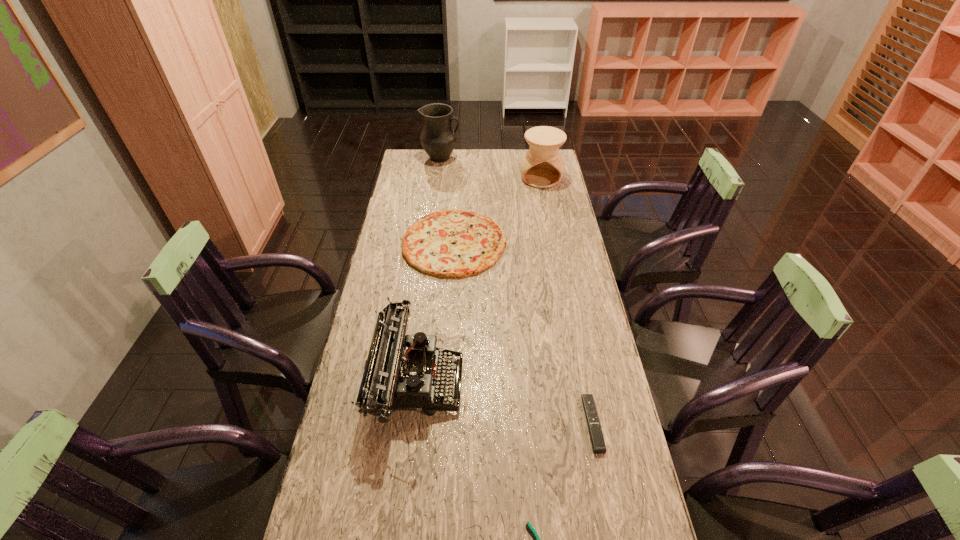
I want to click on the farthest object, so click(x=438, y=139).

At what (x,y) coordinates should I click in order to perform the action: click on pottery. Please return your answer as a coordinate pair (x, y). The height and width of the screenshot is (540, 960). Looking at the image, I should click on (542, 166).

I want to click on the fourth shortest object, so click(x=402, y=372).

Where is `the third shortest object`? Image resolution: width=960 pixels, height=540 pixels. the third shortest object is located at coordinates (451, 243).

Identify the location of pizza. The image size is (960, 540). (x=451, y=243).

Where is `remote control`? remote control is located at coordinates (596, 436).

You are a GUI agent. You are given a task and a screenshot of the screen. Output one action in this format:
    pyautogui.click(x=<x>, y=<y>)
    Task: Click on the free spot located 0.140m on the handle side of the farthest object
    
    Given the screenshot: What is the action you would take?
    pyautogui.click(x=489, y=158)

Find the location of `vacant space located 0.200m at the open side of the fifth nearest object`. vacant space located 0.200m at the open side of the fifth nearest object is located at coordinates (548, 215).

The width and height of the screenshot is (960, 540). Identify the location of free space located 0.170m on the keyboard of the third tallest object. (521, 380).

Find the location of `free space located 0.230m on the front of the fourth tallest object`. free space located 0.230m on the front of the fourth tallest object is located at coordinates 448,329.